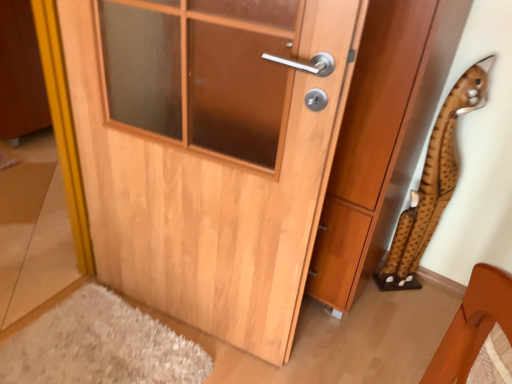
Question: Considering their positions, is light wood door at center located in front of or behind wooden door at center?

Choices:
 (A) front
 (B) behind

Answer: (A)

Question: Would you say light wood door at center is inside or outside wooden door at center?

Choices:
 (A) inside
 (B) outside

Answer: (B)

Question: Which object is positioned closest to the wooden door at center?

Choices:
 (A) brown spotted plush at right
 (B) light wood door at center

Answer: (A)

Question: Which object is the closest to the wooden door at center?

Choices:
 (A) light wood door at center
 (B) brown spotted plush at right

Answer: (B)